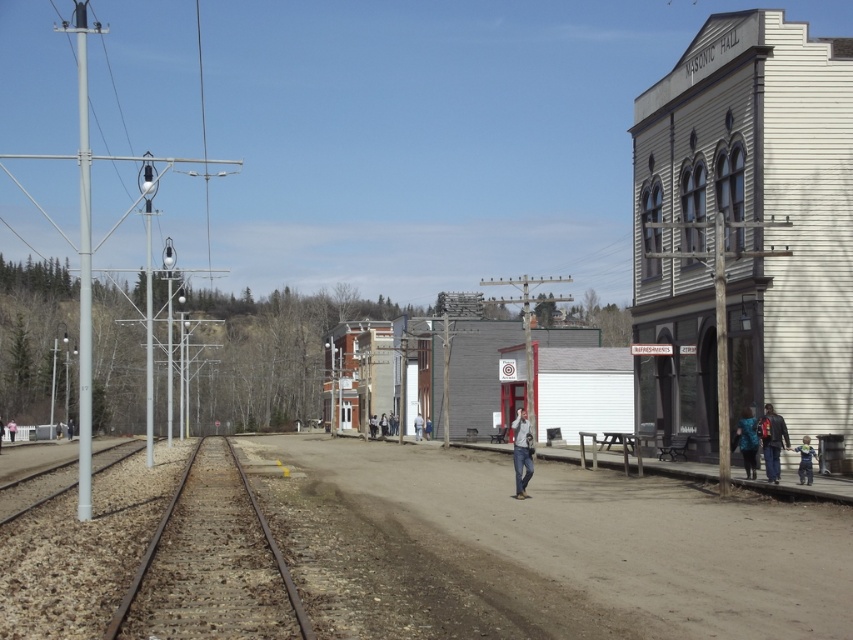
Does blue textured coat at lower right have a greater width compared to blue denim jeans at lower right?

Yes, blue textured coat at lower right is wider than blue denim jeans at lower right.

Image resolution: width=853 pixels, height=640 pixels. What do you see at coordinates (746, 442) in the screenshot?
I see `blue textured coat at lower right` at bounding box center [746, 442].

The image size is (853, 640). Find the location of `blue textured coat at lower right`. blue textured coat at lower right is located at coordinates (746, 442).

Can you confirm if light brown leather jacket at center is taller than white cotton shirt at center?

Correct, light brown leather jacket at center is much taller as white cotton shirt at center.

Who is more forward, (422, 426) or (368, 426)?

Point (422, 426)

The height and width of the screenshot is (640, 853). Describe the element at coordinates (418, 426) in the screenshot. I see `light brown leather jacket at center` at that location.

At what (x,y) coordinates should I click in order to perform the action: click on light brown leather jacket at center. Please return your answer as a coordinate pair (x, y). This screenshot has width=853, height=640. Looking at the image, I should click on (418, 426).

Is denim jeans at center closer to the viewer compared to blue denim jeans at lower right?

Yes, denim jeans at center is closer to the viewer.

Between denim jeans at center and blue denim jeans at lower right, which one has more height?

denim jeans at center is taller.

This screenshot has height=640, width=853. I want to click on denim jeans at center, so pos(521,452).